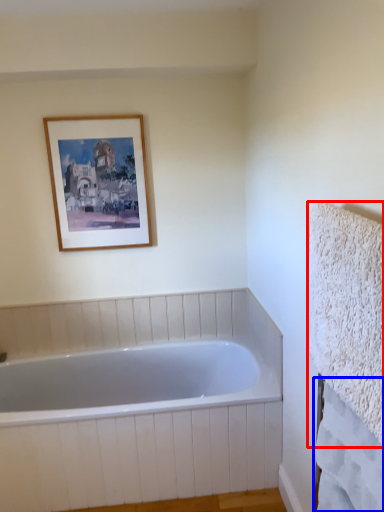
Question: Among these objects, which one is nearest to the camera, bath towel (highlighted by a red box) or bath towel (highlighted by a blue box)?

Choices:
 (A) bath towel
 (B) bath towel

Answer: (A)